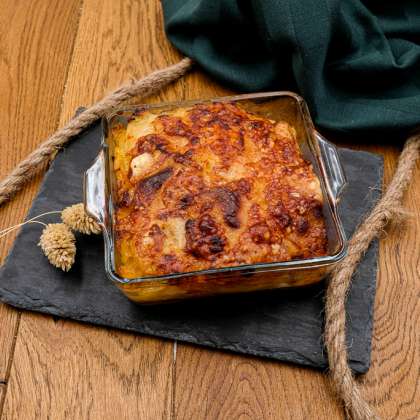
Where is `hot pad`? The height and width of the screenshot is (420, 420). hot pad is located at coordinates (261, 344).